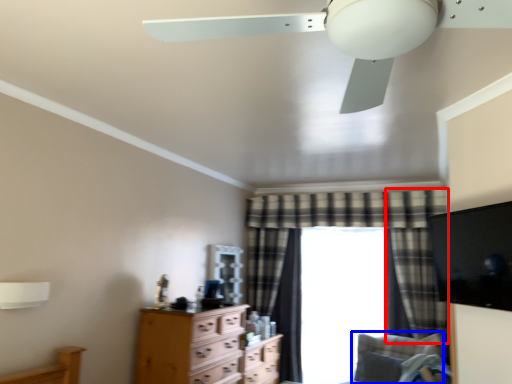
Question: Which point is further to the camera, curtain (highlighted by a red box) or swivel chair (highlighted by a blue box)?

Choices:
 (A) curtain
 (B) swivel chair

Answer: (A)